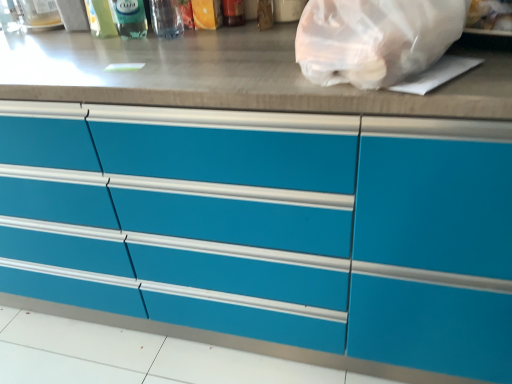
Question: Considering the positions of translucent plastic bottle at upper center, which appears as the third bottle when viewed from the right, and transparent plastic bottle at upper center, marked as the 1th bottle in a right-to-left arrangement, in the image, is translucent plastic bottle at upper center, which appears as the third bottle when viewed from the right, taller or shorter than transparent plastic bottle at upper center, marked as the 1th bottle in a right-to-left arrangement,?

Choices:
 (A) short
 (B) tall

Answer: (B)

Question: In the image, is translucent plastic bottle at upper center, which is the first bottle from left to right, positioned in front of or behind transparent plastic bottle at upper center, placed as the third bottle when sorted from left to right?

Choices:
 (A) behind
 (B) front

Answer: (A)

Question: Which object is positioned closest to the transparent plastic bottle at upper left, which is the 2th bottle in left-to-right order?

Choices:
 (A) matte blue drawers at center
 (B) translucent plastic bottle at upper center, which is the first bottle from left to right
 (C) transparent plastic bag at upper right
 (D) transparent plastic bottle at upper center, placed as the third bottle when sorted from left to right

Answer: (D)

Question: Which object is the closest to the transparent plastic bag at upper right?

Choices:
 (A) transparent plastic bottle at upper center, placed as the third bottle when sorted from left to right
 (B) matte blue drawers at center
 (C) translucent plastic bottle at upper center, which is the first bottle from left to right
 (D) transparent plastic bottle at upper left, which is the second bottle in right-to-left order

Answer: (B)